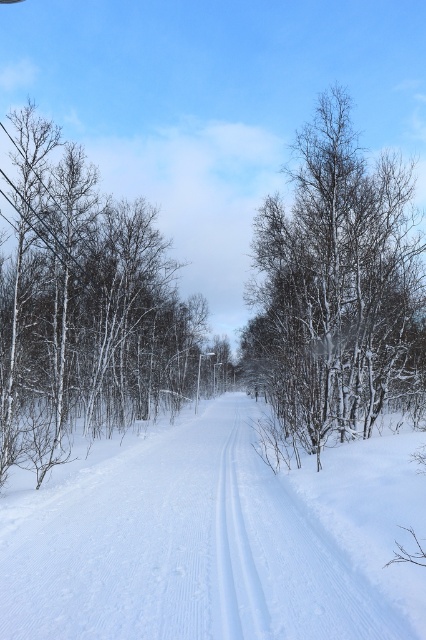
Question: Can you confirm if snow-covered tree at center is thinner than white snow trail at center?

Choices:
 (A) no
 (B) yes

Answer: (A)

Question: Is the position of snow-covered tree at center more distant than that of white snow trail at center?

Choices:
 (A) yes
 (B) no

Answer: (A)

Question: Estimate the real-world distances between objects in this image. Which object is closer to the snow-covered trees at left?

Choices:
 (A) white snow trail at center
 (B) snow-covered tree at center

Answer: (B)

Question: Which object is the farthest from the snow-covered trees at left?

Choices:
 (A) white snow trail at center
 (B) snow-covered tree at center

Answer: (A)

Question: Does white powdery snow at center have a greater width compared to snow-covered trees at left?

Choices:
 (A) no
 (B) yes

Answer: (A)

Question: Which of these objects is positioned farthest from the snow-covered trees at left?

Choices:
 (A) white snow trail at center
 (B) snow-covered tree at center

Answer: (A)